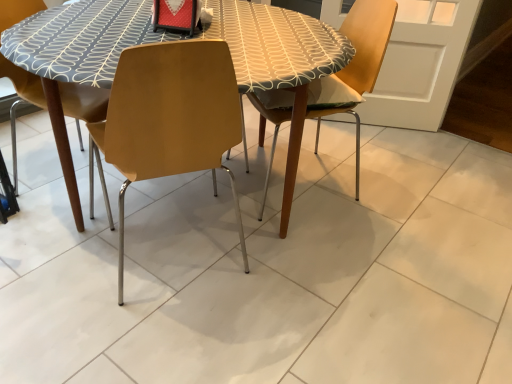
Question: Considering the positions of point (164, 165) and point (311, 87), is point (164, 165) closer or farther from the camera than point (311, 87)?

Choices:
 (A) closer
 (B) farther

Answer: (A)

Question: In terms of height, does matte wood chair at center, acting as the 1th chair starting from the left, look taller or shorter compared to wooden chair at center, placed as the 1th chair when sorted from right to left?

Choices:
 (A) tall
 (B) short

Answer: (A)

Question: Looking at their shapes, would you say matte wood chair at center, the 2th chair from the right, is wider or thinner than wooden chair at center, the second chair in the left-to-right sequence?

Choices:
 (A) thin
 (B) wide

Answer: (A)

Question: From their relative heights in the image, would you say wooden chair at center, placed as the 1th chair when sorted from right to left, is taller or shorter than matte wood chair at center, acting as the 1th chair starting from the left?

Choices:
 (A) short
 (B) tall

Answer: (A)

Question: From the image's perspective, is wooden chair at center, placed as the 1th chair when sorted from right to left, positioned above or below matte wood chair at center, acting as the 1th chair starting from the left?

Choices:
 (A) below
 (B) above

Answer: (B)

Question: From a real-world perspective, relative to matte wood chair at center, the 2th chair from the right, is wooden chair at center, the second chair in the left-to-right sequence, vertically above or below?

Choices:
 (A) below
 (B) above

Answer: (A)

Question: Considering their positions, is wooden chair at center, the second chair in the left-to-right sequence, located in front of or behind matte wood chair at center, acting as the 1th chair starting from the left?

Choices:
 (A) behind
 (B) front

Answer: (A)